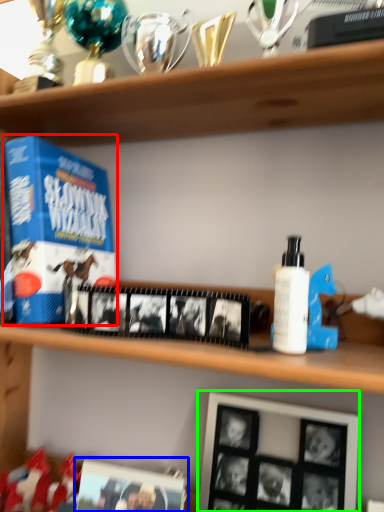
Question: Estimate the real-world distances between objects in this image. Which object is closer to product (highlighted by a red box), picture frame (highlighted by a blue box) or picture frame (highlighted by a green box)?

Choices:
 (A) picture frame
 (B) picture frame

Answer: (A)